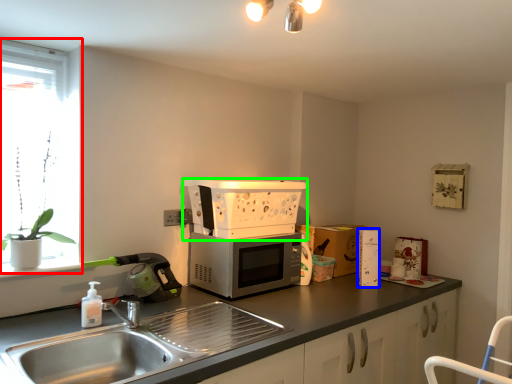
Question: Which is farther away from window (highlighted by a red box)? appliance (highlighted by a blue box) or appliance (highlighted by a green box)?

Choices:
 (A) appliance
 (B) appliance

Answer: (A)